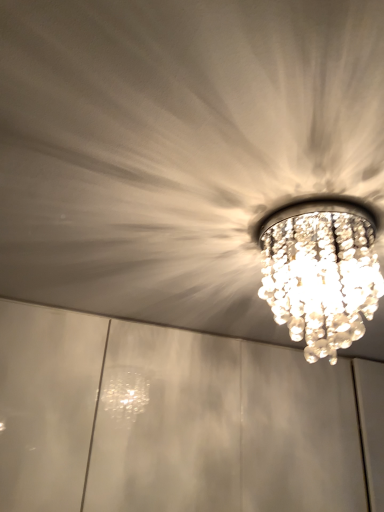
Describe the element at coordinates (321, 271) in the screenshot. This screenshot has width=384, height=512. I see `clear crystal chandelier at upper center` at that location.

Where is `clear crystal chandelier at upper center`? clear crystal chandelier at upper center is located at coordinates (321, 271).

This screenshot has width=384, height=512. In order to click on clear crystal chandelier at upper center in this screenshot , I will do `click(321, 271)`.